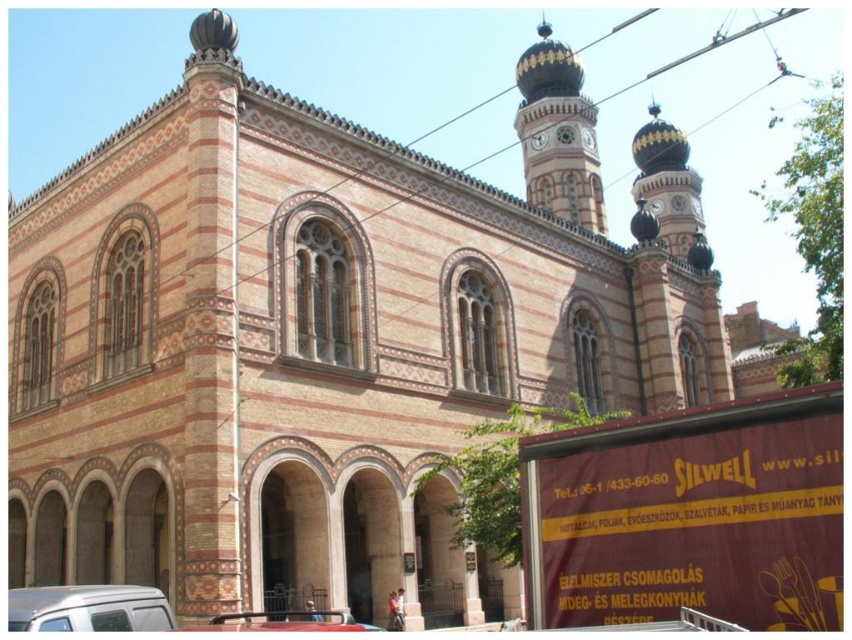
Looking at this image, you are a visitor arriving at the synagogue and need to park your car. You see a white matte van at lower left and a metallic silver car at lower center. Which parking spot is closer to the entrance?

The metallic silver car at lower center is closer to the entrance because the white matte van at lower left is to the left of it, meaning the metallic silver car is positioned nearer to the entrance area.

You are a delivery person who needs to park your white matte van at lower left and metallic silver car at lower center in a parking lot. The parking spot between them can only accommodate vehicles totaling 10 meters in length. Can both vehicles fit together in the space?

The white matte van at lower left is 6.20 meters from metallic silver car at lower center. Since the combined length of both vehicles is 6.20 meters, which is less than the 10 meters required, they can fit together in the parking space.